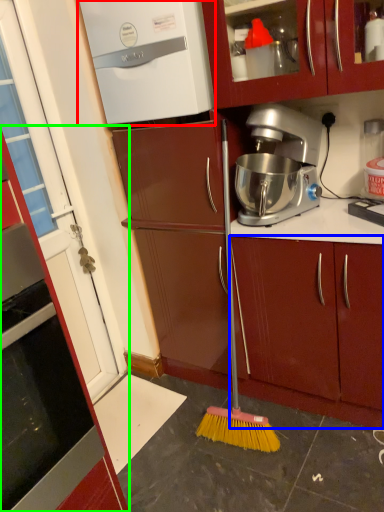
Question: Which is nearer to the home appliance (highlighted by a red box)? cabinetry (highlighted by a blue box) or cabinetry (highlighted by a green box).

Choices:
 (A) cabinetry
 (B) cabinetry

Answer: (A)